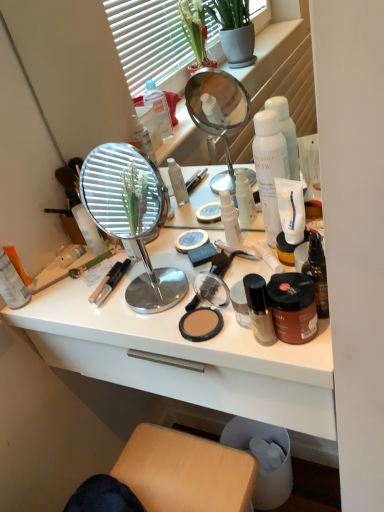
What are the coordinates of `vacant area that lies between silver/metallic mirror at center and orange matte lotion at left, positioned as the first toiletry in left-to-right order` in the screenshot? It's located at (79, 297).